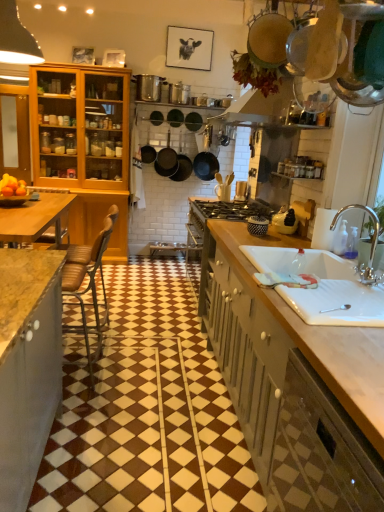
This screenshot has height=512, width=384. In order to click on vacant area in front of silver metallic faucet at sink right in this screenshot , I will do `click(360, 291)`.